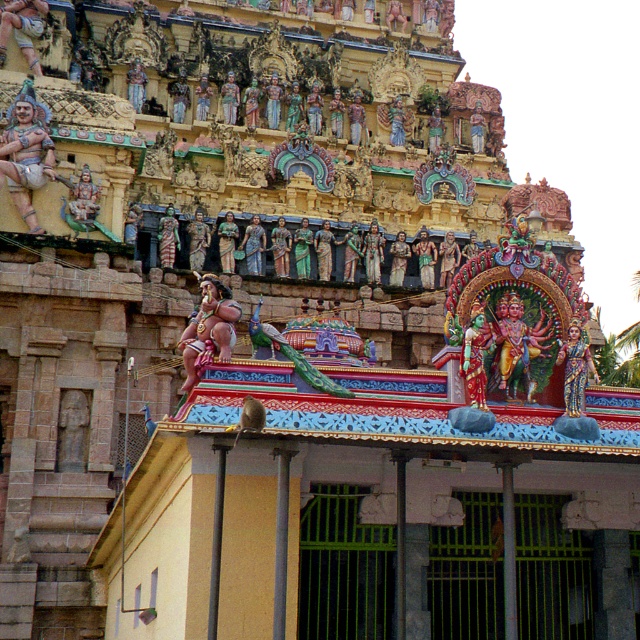
Can you confirm if golden polished statue at center is shorter than polished bronze statue at center?

No.

Does golden polished statue at center have a greater width compared to polished bronze statue at center?

Yes, golden polished statue at center is wider than polished bronze statue at center.

You are a GUI agent. You are given a task and a screenshot of the screen. Output one action in this format:
    pyautogui.click(x=<x>, y=<y>)
    Task: Click on the golden polished statue at center
    Image resolution: width=640 pixels, height=640 pixels.
    Given the screenshot: What is the action you would take?
    pyautogui.click(x=209, y=328)

Where is `golden polished statue at center`? The width and height of the screenshot is (640, 640). golden polished statue at center is located at coordinates (209, 328).

Can you confirm if glossy painted statue at center is taller than polished bronze statue at center?

Yes.

Who is lower down, glossy painted statue at center or polished bronze statue at center?

glossy painted statue at center

Identify the location of glossy painted statue at center. (518, 333).

Where is `glossy painted statue at center`? This screenshot has height=640, width=640. glossy painted statue at center is located at coordinates (518, 333).

Can you confirm if golden polished statue at center is shorter than golden painted statue at center?

No.

Which of these two, golden polished statue at center or golden painted statue at center, stands taller?

golden polished statue at center

This screenshot has width=640, height=640. What do you see at coordinates (209, 328) in the screenshot?
I see `golden polished statue at center` at bounding box center [209, 328].

This screenshot has width=640, height=640. In order to click on golden polished statue at center in this screenshot , I will do `click(209, 328)`.